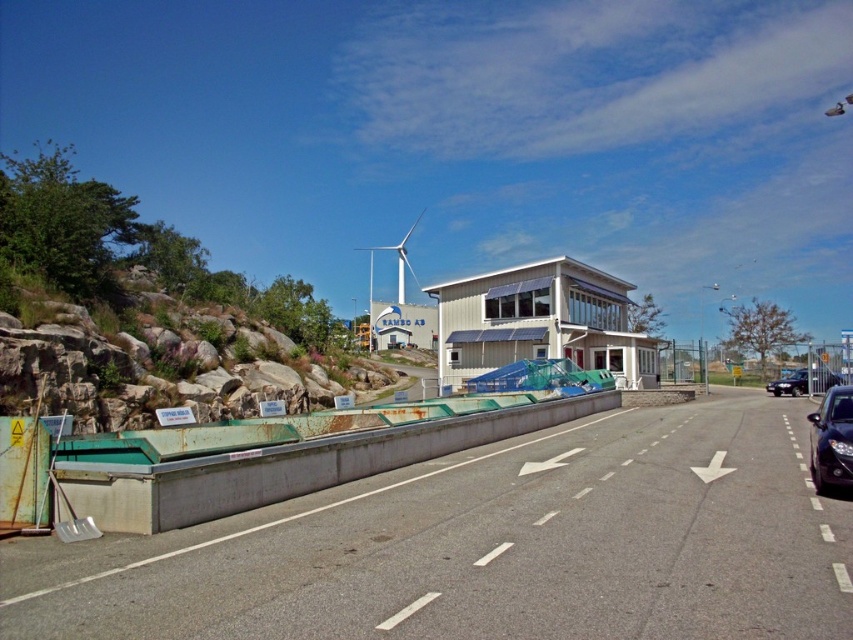
You are a delivery driver who needs to park your vehicle in a space that can accommodate the height of both the black glossy car at right and the dark blue metallic car at right. What should you consider about their heights?

The black glossy car at right is not as tall as the dark blue metallic car at right, so you should ensure the parking space can accommodate the height of the taller dark blue metallic car at right.

You are a delivery truck driver who needs to navigate between the rusty rock at left and the white matte wind turbine at center. Given that your truck is 3 meters wide, can you safely pass through the space between them?

The rusty rock at left has a lesser width compared to the white matte wind turbine at center. However, the exact distance between them isn t specified in the provided information. Without knowing the actual space between the two objects, it s impossible to determine if the truck can safely pass through. Please check the distance between them before proceeding.